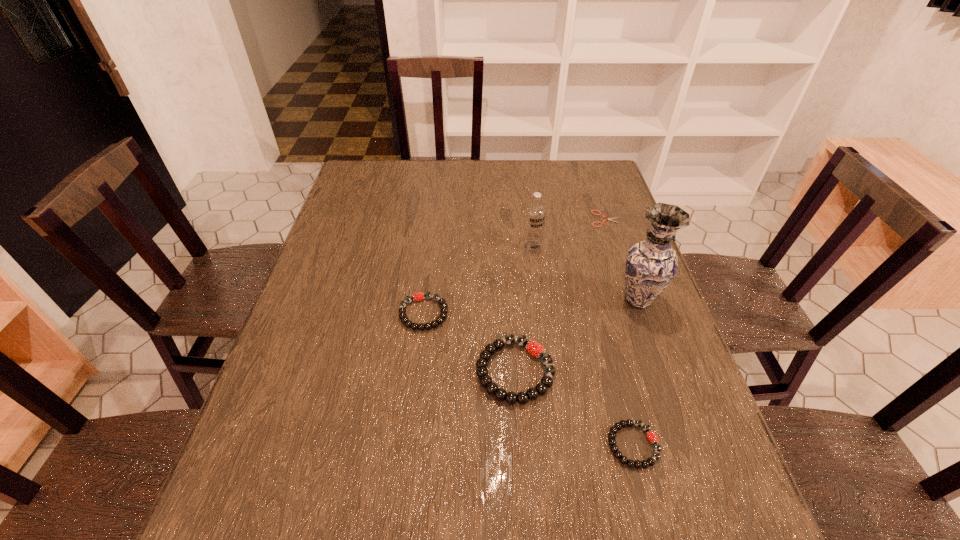
Locate an element on the screen. The height and width of the screenshot is (540, 960). free space for a new bracelet on the left is located at coordinates (350, 267).